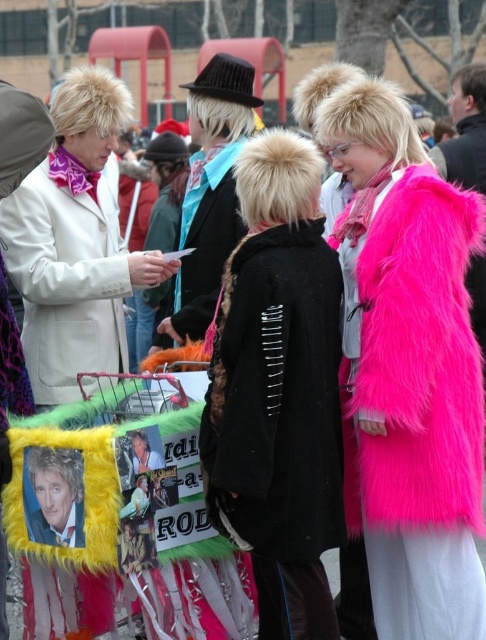
Question: Based on their relative distances, which object is farther from the fuzzy pink coat at upper right?

Choices:
 (A) white fur coat at left
 (B) black fur coat at center

Answer: (A)

Question: Which of the following is the farthest from the observer?

Choices:
 (A) (211, 356)
 (B) (75, 225)

Answer: (B)

Question: Does black fur coat at center have a larger size compared to white fur coat at left?

Choices:
 (A) yes
 (B) no

Answer: (B)

Question: Is black fur coat at center wider than white fur coat at left?

Choices:
 (A) yes
 (B) no

Answer: (B)

Question: Does fuzzy pink coat at upper right have a greater width compared to black fur coat at center?

Choices:
 (A) no
 (B) yes

Answer: (B)

Question: Which point is closer to the camera?

Choices:
 (A) (468, 352)
 (B) (41, 209)
 (C) (292, 406)

Answer: (C)